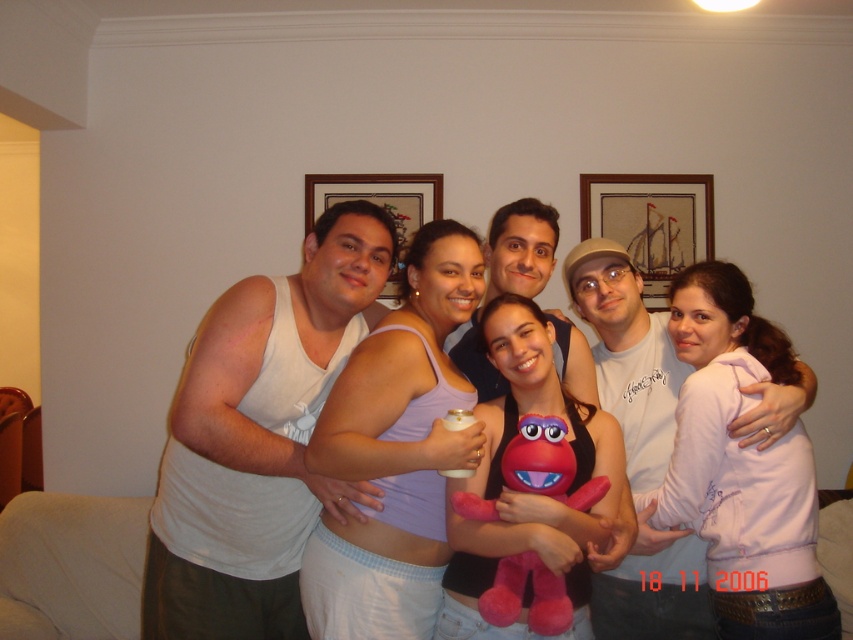
Does white matte tank top at center appear on the right side of light purple fabric tank top at center?

Incorrect, white matte tank top at center is not on the right side of light purple fabric tank top at center.

Identify the location of white matte tank top at center. (258, 436).

Which is behind, point (170, 540) or point (468, 435)?

The point (170, 540) is more distant.

Find the location of a particular element. white matte tank top at center is located at coordinates (258, 436).

Does white t-shirt at center appear on the left side of matte pink plush at center?

No, white t-shirt at center is not to the left of matte pink plush at center.

Does point (753, 413) lie behind point (589, 493)?

Yes, it is behind point (589, 493).

At what (x,y) coordinates should I click in order to perform the action: click on white t-shirt at center. Please return your answer as a coordinate pair (x, y). This screenshot has height=640, width=853. Looking at the image, I should click on (627, 355).

Is matte pink plush at center below matte white tank top at center?

Indeed, matte pink plush at center is positioned under matte white tank top at center.

What are the coordinates of `matte pink plush at center` in the screenshot? It's located at pos(517,592).

Is point (540, 609) behind point (526, 250)?

No, (540, 609) is closer to viewer.

Find the location of `matte pink plush at center`. matte pink plush at center is located at coordinates (517, 592).